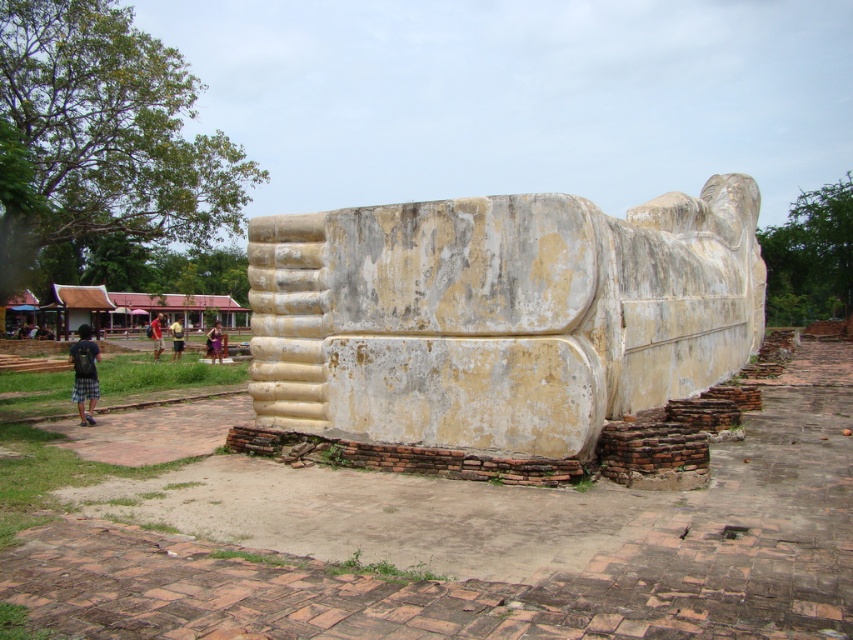
Question: Among these points, which one is farthest from the camera?

Choices:
 (A) (177, 328)
 (B) (155, 356)

Answer: (A)

Question: Which of the following is the farthest from the observer?

Choices:
 (A) (155, 346)
 (B) (85, 385)

Answer: (A)

Question: Which of the following is the farthest from the observer?

Choices:
 (A) (215, 323)
 (B) (592, 397)
 (C) (80, 326)

Answer: (A)

Question: Does white stone statue at center have a larger size compared to light brown wooden bench at center?

Choices:
 (A) yes
 (B) no

Answer: (A)

Question: Can you confirm if dark blue plaid shorts at lower left is thinner than light brown fabric shorts at center?

Choices:
 (A) yes
 (B) no

Answer: (B)

Question: In this image, where is light brown wooden bench at center located relative to light brown wooden stick at center?

Choices:
 (A) left
 (B) right

Answer: (B)